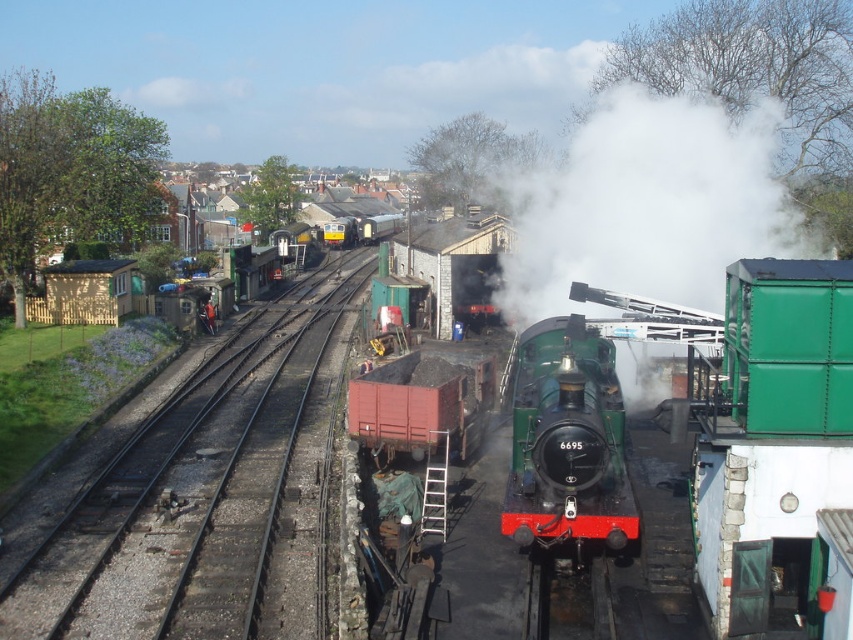
Question: Which point appears farthest from the camera in this image?

Choices:
 (A) (340, 476)
 (B) (541, 412)

Answer: (A)

Question: Which object is farther from the camera taking this photo?

Choices:
 (A) black metal train track at center
 (B) green polished wood steam engine at center

Answer: (A)

Question: Estimate the real-world distances between objects in this image. Which object is closer to the black metal train track at center?

Choices:
 (A) white matte steam at center
 (B) green polished wood steam engine at center
 (C) rusty metal coal car at center

Answer: (C)

Question: Observing the image, what is the correct spatial positioning of black metal train track at center in reference to green polished wood steam engine at center?

Choices:
 (A) below
 (B) above

Answer: (A)

Question: Does black metal train track at center come in front of green polished wood steam engine at center?

Choices:
 (A) no
 (B) yes

Answer: (A)

Question: Can you confirm if white matte steam at center is thinner than rusty metal coal car at center?

Choices:
 (A) yes
 (B) no

Answer: (B)